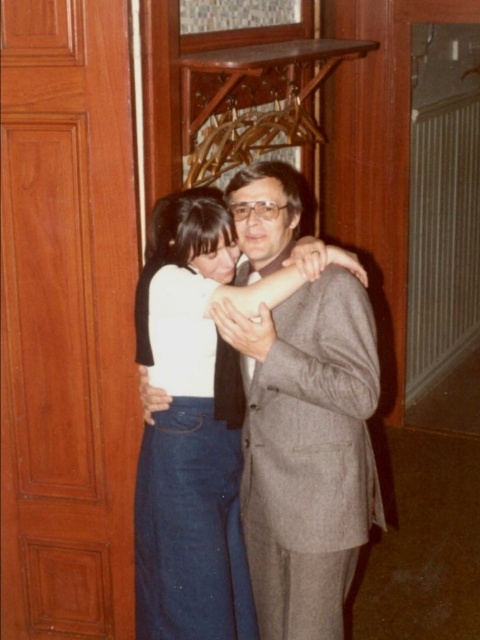
Question: Does matte gray suit at center have a larger size compared to white matte dress at center?

Choices:
 (A) yes
 (B) no

Answer: (A)

Question: Is matte gray suit at center below white matte dress at center?

Choices:
 (A) yes
 (B) no

Answer: (B)

Question: In this image, where is matte gray suit at center located relative to white matte dress at center?

Choices:
 (A) above
 (B) below

Answer: (A)

Question: Which object appears closest to the camera in this image?

Choices:
 (A) matte gray suit at center
 (B) white matte dress at center

Answer: (A)

Question: Which point is farther to the camera?

Choices:
 (A) (332, 620)
 (B) (147, 474)

Answer: (B)

Question: Which point is farther to the camera?

Choices:
 (A) white matte dress at center
 (B) matte gray suit at center

Answer: (A)